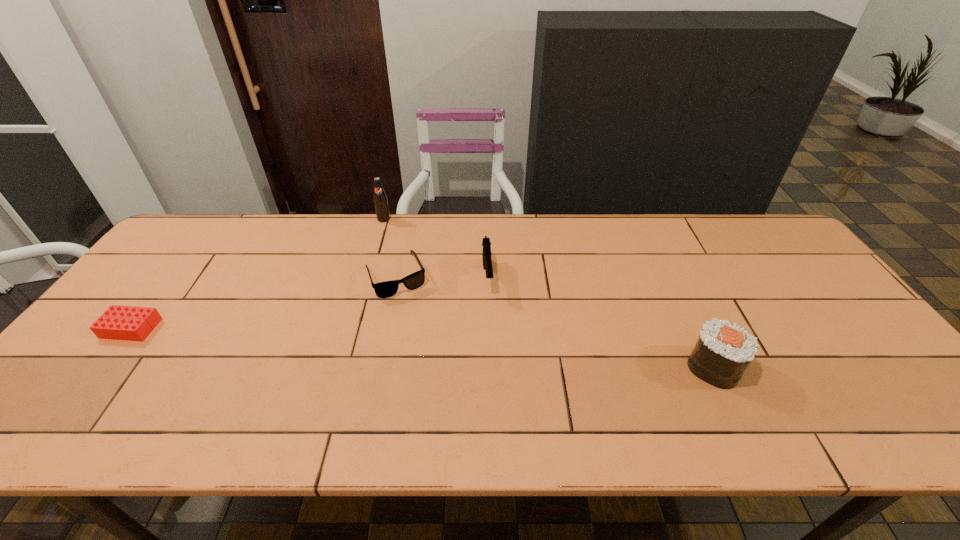
You are a GUI agent. You are given a task and a screenshot of the screen. Output one action in this format:
    pyautogui.click(x=<x>, y=<y>)
    Task: Click on the vacant area located on the front-facing side of the fourth tallest object
    The height and width of the screenshot is (540, 960).
    Given the screenshot: What is the action you would take?
    pyautogui.click(x=424, y=336)

Image resolution: width=960 pixels, height=540 pixels. Find the location of `vacant space situated 0.270m on the front-facing side of the fourth tallest object`. vacant space situated 0.270m on the front-facing side of the fourth tallest object is located at coordinates (442, 371).

What are the coordinates of `vacant space located on the front-facing side of the fourth tallest object` in the screenshot? It's located at (419, 325).

The image size is (960, 540). I want to click on vacant area situated 0.300m on the front label of the farthest object, so click(382, 282).

Find the location of a particular element. The width and height of the screenshot is (960, 540). free spot located on the front label of the farthest object is located at coordinates (383, 244).

At what (x,y) coordinates should I click in order to perform the action: click on vacant area located 0.320m on the front label of the farthest object. Please return your answer as a coordinate pair (x, y). This screenshot has height=540, width=960. Looking at the image, I should click on 381,287.

Image resolution: width=960 pixels, height=540 pixels. I want to click on free space located on the front-facing side of the pistol, so click(x=490, y=314).

Where is `free point located on the front-facing side of the pistol`? free point located on the front-facing side of the pistol is located at coordinates (491, 326).

Where is `free space located on the front-facing side of the pistol`? The width and height of the screenshot is (960, 540). free space located on the front-facing side of the pistol is located at coordinates (496, 388).

Identify the location of sunglasses at the far edge. The image size is (960, 540). (386, 289).